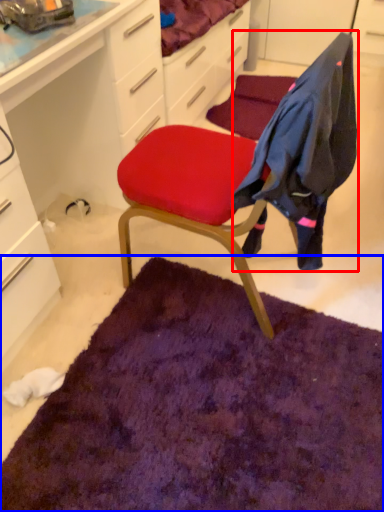
Question: Which object appears farthest to the camera in this image, clothing (highlighted by a red box) or mat (highlighted by a blue box)?

Choices:
 (A) clothing
 (B) mat

Answer: (B)